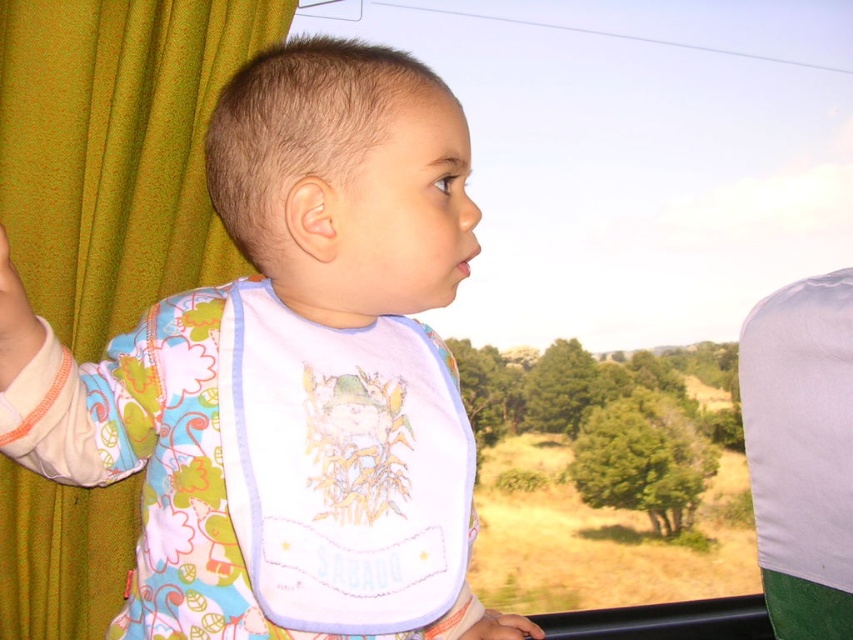
Question: In this image, where is green fabric curtain at left located relative to smooth skin hand at lower center?

Choices:
 (A) above
 (B) below

Answer: (A)

Question: Does green fabric curtain at left appear on the left side of smooth skin hand at lower center?

Choices:
 (A) no
 (B) yes

Answer: (B)

Question: Among these points, which one is farthest from the camera?

Choices:
 (A) (511, 637)
 (B) (415, 544)
 (C) (183, 58)

Answer: (C)

Question: Which object appears farthest from the camera in this image?

Choices:
 (A) smooth skin hand at lower center
 (B) green fabric curtain at left

Answer: (B)

Question: Which object is closer to the camera taking this photo?

Choices:
 (A) white fabric bib at center
 (B) green fabric curtain at left

Answer: (A)

Question: Does green fabric curtain at left appear under white fabric bib at center?

Choices:
 (A) yes
 (B) no

Answer: (B)